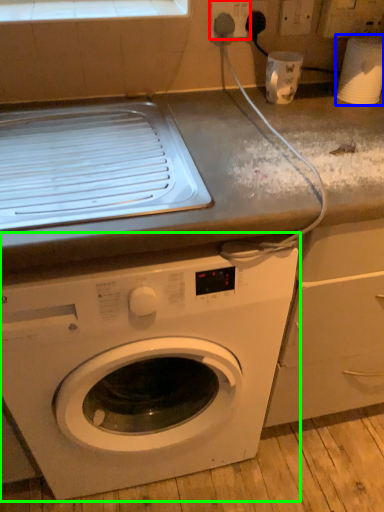
Question: Based on their relative distances, which object is nearer to electric outlet (highlighted by a red box)? Choose from appliance (highlighted by a blue box) and washing machine (highlighted by a green box).

Choices:
 (A) appliance
 (B) washing machine

Answer: (A)